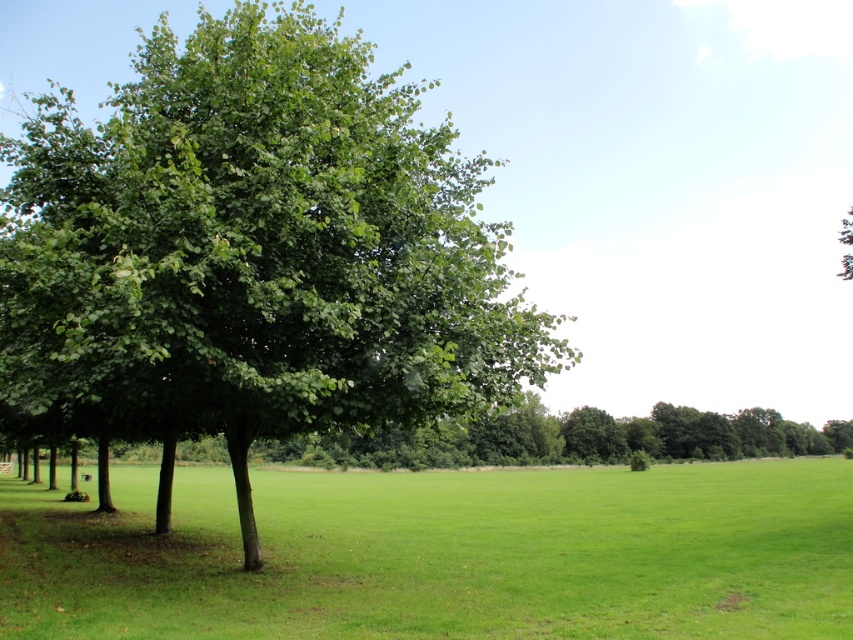
Who is positioned more to the left, green leafy tree at left or green leafy tree at center?

Positioned to the left is green leafy tree at left.

Who is taller, green leafy tree at left or green leafy tree at center?

With more height is green leafy tree at left.

Describe the element at coordinates (254, 252) in the screenshot. I see `green leafy tree at left` at that location.

Locate an element on the screen. The image size is (853, 640). green leafy tree at left is located at coordinates (254, 252).

Who is positioned more to the right, green leafy tree at left or green grassy field at center?

Positioned to the right is green grassy field at center.

Can you confirm if green leafy tree at left is positioned above green grassy field at center?

Yes, green leafy tree at left is above green grassy field at center.

Does point (242, 184) come closer to viewer compared to point (463, 492)?

That is True.

Find the location of a particular element. This screenshot has width=853, height=640. green leafy tree at left is located at coordinates (254, 252).

Where is `green grassy field at center`? The image size is (853, 640). green grassy field at center is located at coordinates (442, 554).

What do you see at coordinates (442, 554) in the screenshot? Image resolution: width=853 pixels, height=640 pixels. I see `green grassy field at center` at bounding box center [442, 554].

Who is more distant from viewer, (824,627) or (846,253)?

Positioned behind is point (846,253).

I want to click on green grassy field at center, so click(442, 554).